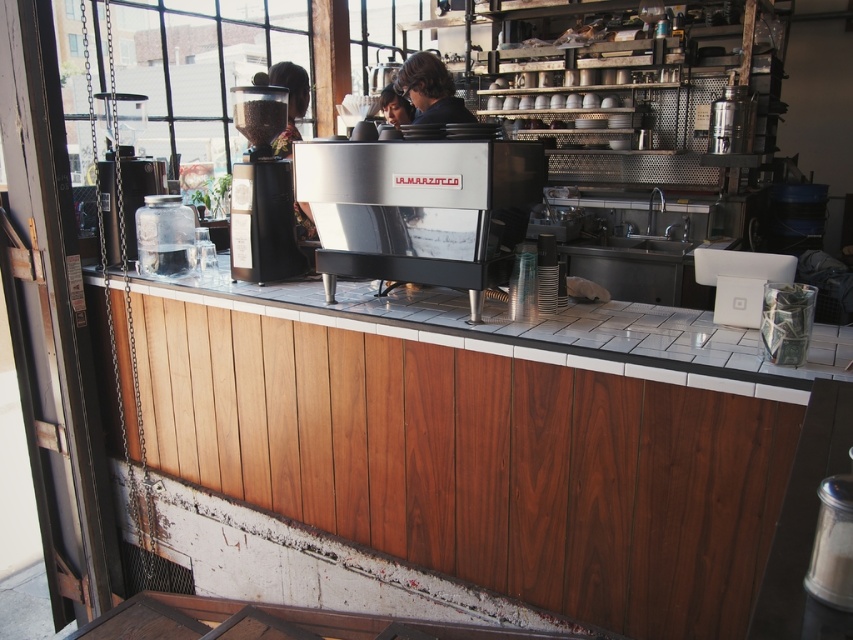
This screenshot has height=640, width=853. In order to click on satin silver/brushed metal coffee machine at center in this screenshot , I will do click(x=419, y=209).

In the scene shown: Which is more to the left, satin silver/brushed metal coffee machine at center or transparent glass window at upper left?

transparent glass window at upper left

Who is more forward, [440,282] or [78,45]?

Point [440,282] is in front.

Locate an element on the screen. satin silver/brushed metal coffee machine at center is located at coordinates (419, 209).

Can you confirm if black plastic coffee grinder at center is bigger than dark brown hair at center?

Indeed, black plastic coffee grinder at center has a larger size compared to dark brown hair at center.

Who is positioned more to the left, black plastic coffee grinder at center or dark brown hair at center?

From the viewer's perspective, black plastic coffee grinder at center appears more on the left side.

Is point (260, 172) positioned in front of point (419, 83)?

Yes.

The image size is (853, 640). In order to click on black plastic coffee grinder at center in this screenshot , I will do `click(260, 189)`.

Does point (465, 148) come farther from viewer compared to point (432, 109)?

No, (465, 148) is closer to viewer.

Locate an element on the screen. satin silver/brushed metal coffee machine at center is located at coordinates (419, 209).